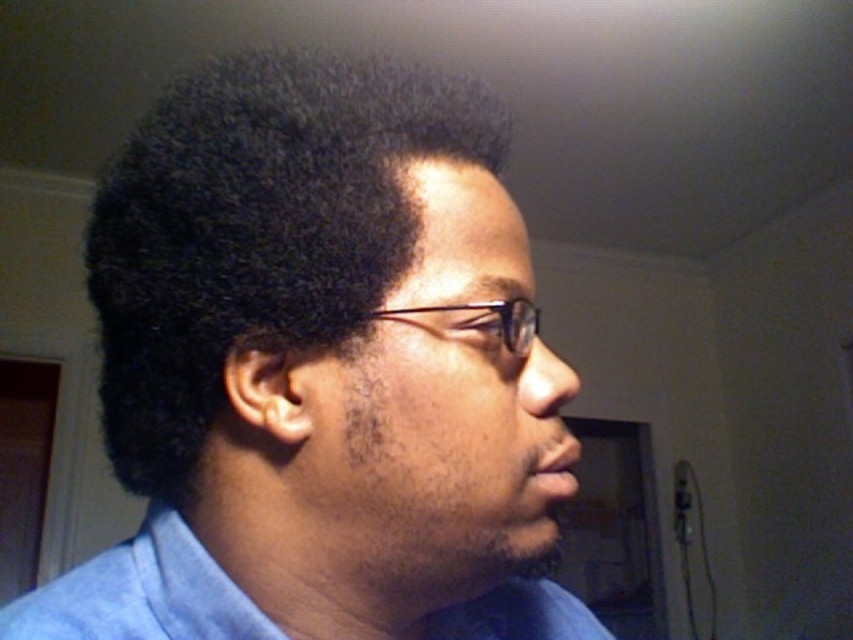
You are a photographer adjusting your camera settings to capture a portrait. You notice the black matte afro at center and the clear plastic glasses at center in your frame. Which object should you focus on first to ensure sharpness?

The black matte afro at center is closer to the viewer than the clear plastic glasses at center, so you should focus on the black matte afro at center first to ensure it appears sharp in the photograph.

You are a photographer adjusting the focus on your camera. You want to ensure that the black matte afro at center is in sharp focus while the background remains slightly blurred. Given the distance between the afro and the camera, what is the minimum focal length you should set to achieve this effect?

To achieve a blurred background with the black matte afro at center in focus, the minimum focal length should be set based on the distance of 11.79 inches. A longer focal length narrows the depth of field, so using a focal length of at least 50mm would help blur the background while keeping the afro sharp.

You are holding a 12 inch ruler and want to measure the distance between yourself and a specific point in the image. The point is located at coordinates point (419, 132). Can you reach this point with your ruler without extending it beyond its 12 inch limit?

The point (419, 132) is 13.27 inches away from the viewer, which is longer than the 12 inch ruler. Therefore, the ruler cannot reach the point without extending beyond its limit.